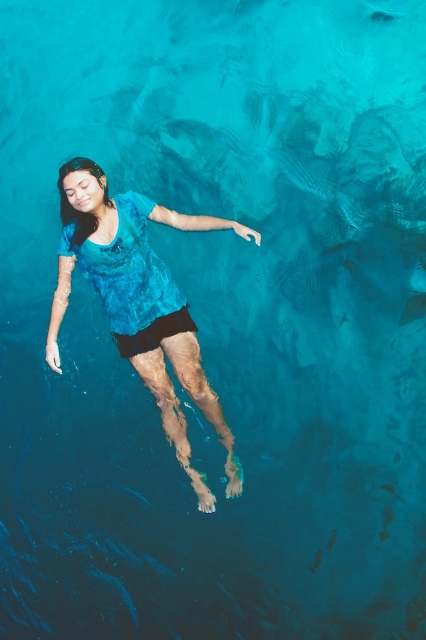
You are a photographer positioned at the camera location. You want to capture a closeup shot of the person floating in the water. The person is located at point (195, 401). Given that your camera has a maximum zoom range of 5 meters, can you get a clear closeup of the person?

The distance between the camera and point (195, 401) is 4.96 meters. Since the camera can zoom up to 5 meters, you can get a clear closeup of the person.

You are a swimmer who wants to place a 30 cm long float between the blue fabric shirt at center and the black matte shorts at center. Can you fit it between them?

The distance between the blue fabric shirt at center and the black matte shorts at center is 29.68 centimeters, so the 30 cm float is slightly too long to fit between them.

You are a photographer trying to capture the perfect shot of the blue fabric shirt at center in the serene water scene. To ensure the shirt is centered in your photo, where should you position your camera relative to the shirt?

The blue fabric shirt at center is located at the 2D coordinates point (138, 300), so you should position your camera directly above or facing that point to center the shirt in your photo.